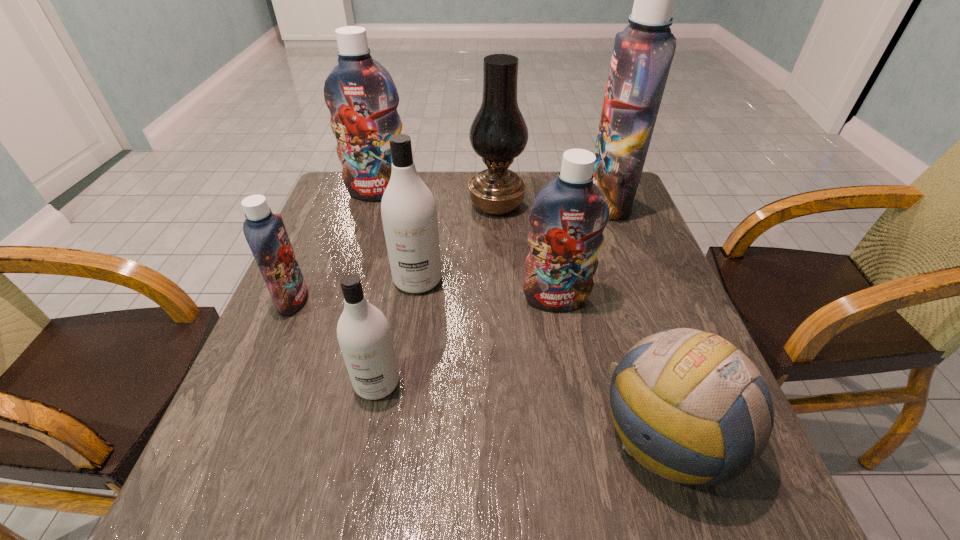
The height and width of the screenshot is (540, 960). What are the coordinates of `free space that satisfies the following two spatial constraints: 1. on the front label of the third biggest blue shampoo; 2. on the right side of the volleyball` in the screenshot? It's located at (580, 435).

Image resolution: width=960 pixels, height=540 pixels. Find the location of `blank space that satisfies the following two spatial constraints: 1. on the front-facing side of the volleyball; 2. on the right side of the farther white shampoo`. blank space that satisfies the following two spatial constraints: 1. on the front-facing side of the volleyball; 2. on the right side of the farther white shampoo is located at coordinates (395, 435).